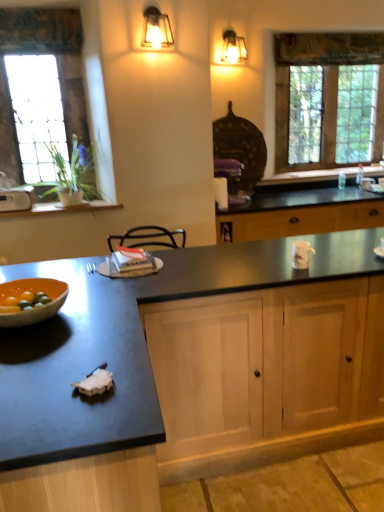
I want to click on free space in front of white crumbly food at center, so coord(81,421).